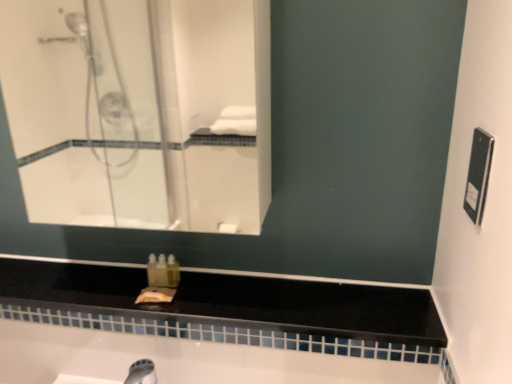
Question: In terms of width, does white glass mirror at upper left look wider or thinner when compared to black matte counter top at center?

Choices:
 (A) wide
 (B) thin

Answer: (B)

Question: From the image's perspective, relative to black matte counter top at center, is white glass mirror at upper left above or below?

Choices:
 (A) above
 (B) below

Answer: (A)

Question: Looking at the image, does white glass mirror at upper left seem bigger or smaller compared to black matte counter top at center?

Choices:
 (A) small
 (B) big

Answer: (B)

Question: From a real-world perspective, is black matte counter top at center positioned above or below white glass mirror at upper left?

Choices:
 (A) below
 (B) above

Answer: (A)

Question: Relative to white glass mirror at upper left, is black matte counter top at center in front or behind?

Choices:
 (A) behind
 (B) front

Answer: (A)

Question: Considering the positions of point (317, 306) and point (253, 132), is point (317, 306) closer or farther from the camera than point (253, 132)?

Choices:
 (A) farther
 (B) closer

Answer: (B)

Question: From their relative heights in the image, would you say black matte counter top at center is taller or shorter than white glass mirror at upper left?

Choices:
 (A) tall
 (B) short

Answer: (B)